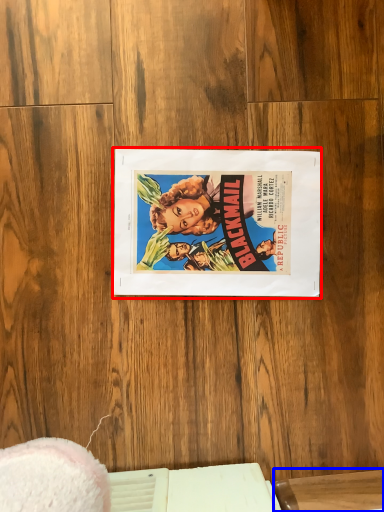
Question: Which of the following is the closest to the observer, paperback book (highlighted by a red box) or table (highlighted by a blue box)?

Choices:
 (A) paperback book
 (B) table

Answer: (B)